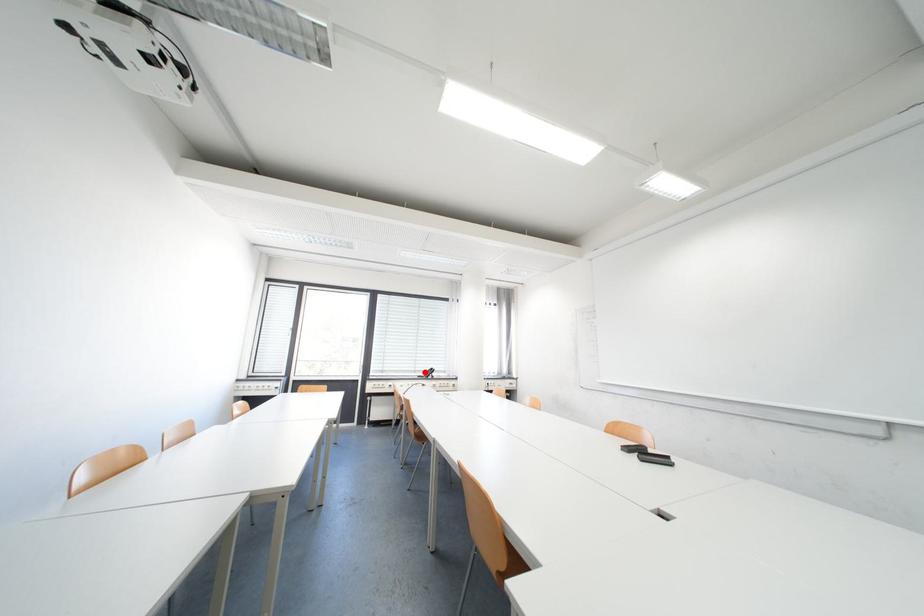
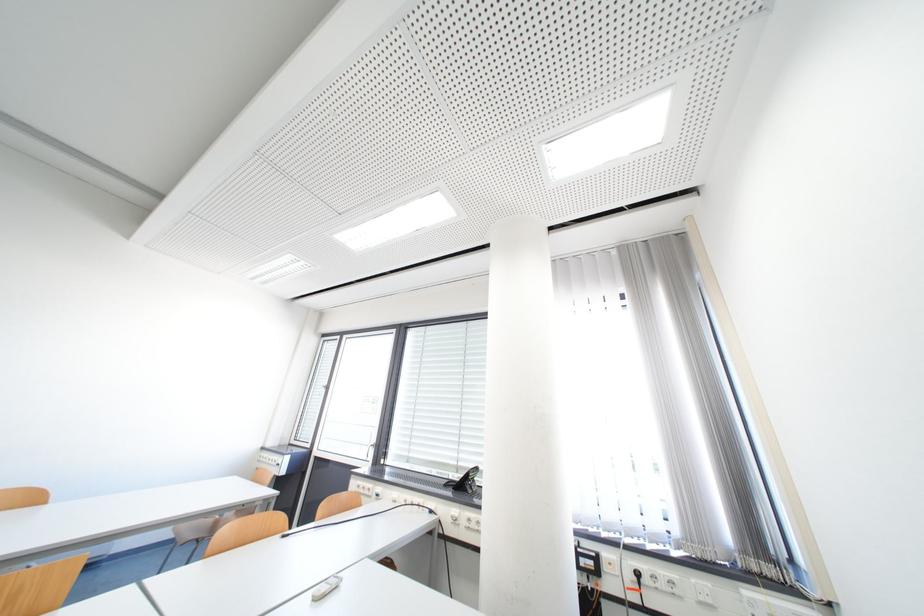
Question: I am providing you with two images of the same scene from different viewpoints. Image1 has a red point marked. In image2, the corresponding 3D location appears at what relative position? Reply with the corresponding letter.

Choices:
 (A) Closer
 (B) Farther

Answer: (B)